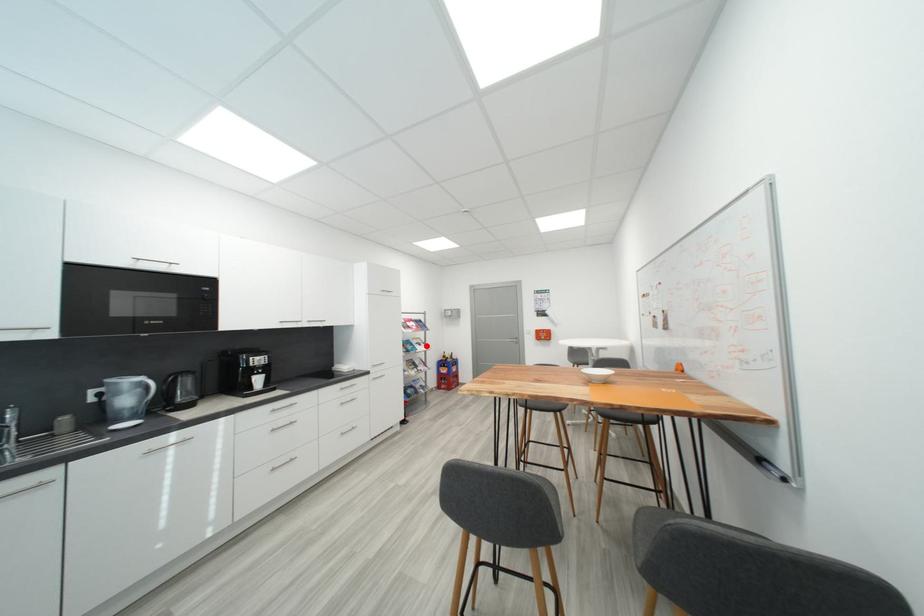
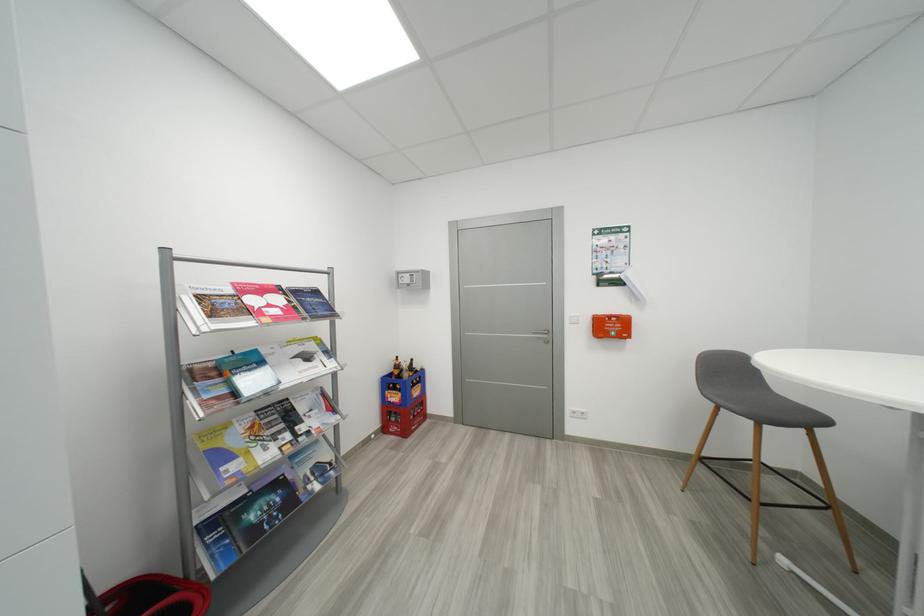
In the second image, find the point that corresponds to the highlighted location in the first image.

(314, 359)